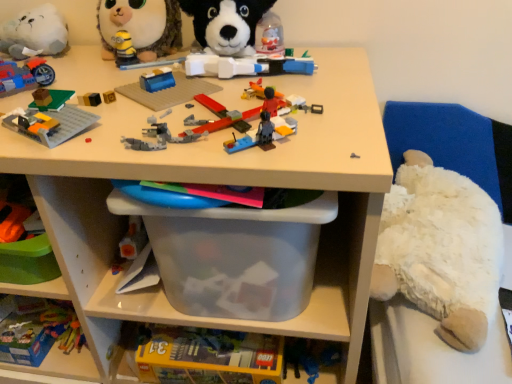
Where is `empty space that is in between translucent plastic airplane at center, arranged as the 3th toy when viewed from the right, and white plush dog at upper center, the seventh toy viewed from the left`? Image resolution: width=512 pixels, height=384 pixels. empty space that is in between translucent plastic airplane at center, arranged as the 3th toy when viewed from the right, and white plush dog at upper center, the seventh toy viewed from the left is located at coordinates (257, 80).